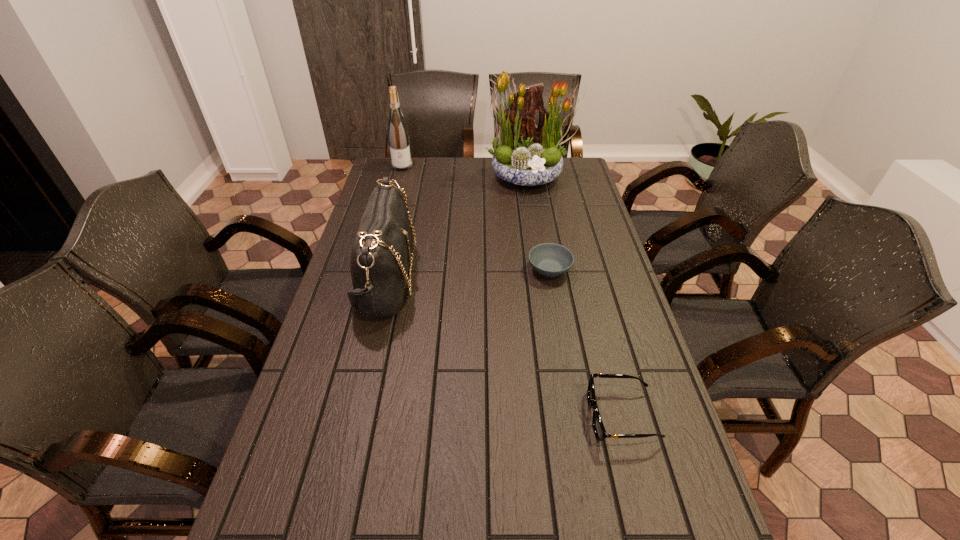
Where is `object that is at the far right corner`? The height and width of the screenshot is (540, 960). object that is at the far right corner is located at coordinates (525, 154).

At what (x,y) coordinates should I click in order to perform the action: click on vacant region at the left edge of the desktop. Please return your answer as a coordinate pair (x, y). Looking at the image, I should click on (344, 333).

This screenshot has width=960, height=540. In the image, there is a desktop. What are the coordinates of `free space at the right edge` in the screenshot? It's located at (607, 416).

Where is `free space at the far right corner of the desktop`? This screenshot has height=540, width=960. free space at the far right corner of the desktop is located at coordinates (586, 176).

At what (x,y) coordinates should I click in order to perform the action: click on free space between the flower arrangement and the fourth shortest object. Please return your answer as a coordinate pair (x, y). Image resolution: width=960 pixels, height=540 pixels. Looking at the image, I should click on (466, 171).

Where is `empty space that is in between the nearest object and the tallest object`? The image size is (960, 540). empty space that is in between the nearest object and the tallest object is located at coordinates (574, 296).

Where is `free space between the tallest object and the fourth shortest object`? The width and height of the screenshot is (960, 540). free space between the tallest object and the fourth shortest object is located at coordinates (466, 171).

Locate an element on the screen. The image size is (960, 540). empty space between the flower arrangement and the wine bottle is located at coordinates (466, 171).

Find the location of `vacant area that lies between the soup bowl and the nearest object`. vacant area that lies between the soup bowl and the nearest object is located at coordinates (586, 343).

Locate an element on the screen. The height and width of the screenshot is (540, 960). free spot between the wine bottle and the tallest object is located at coordinates (466, 171).